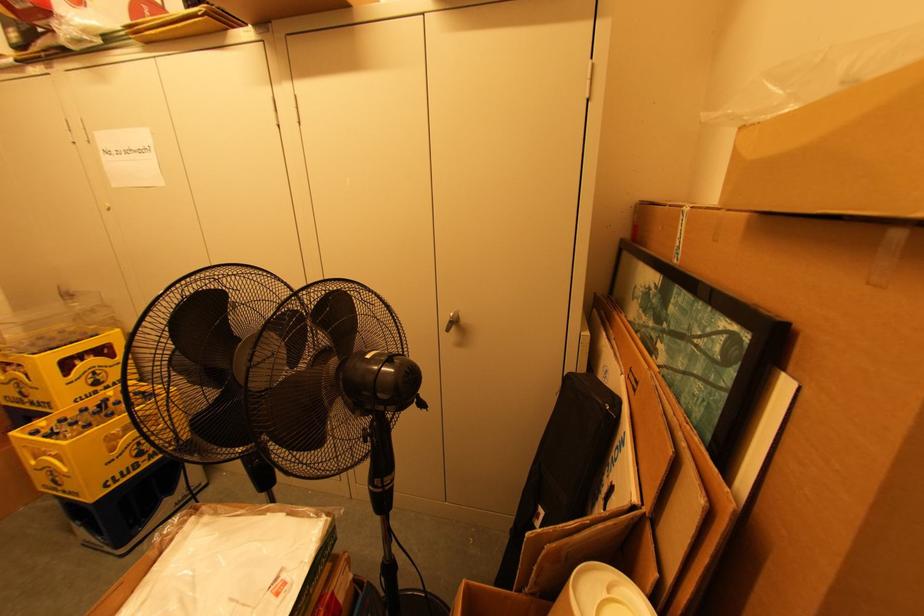
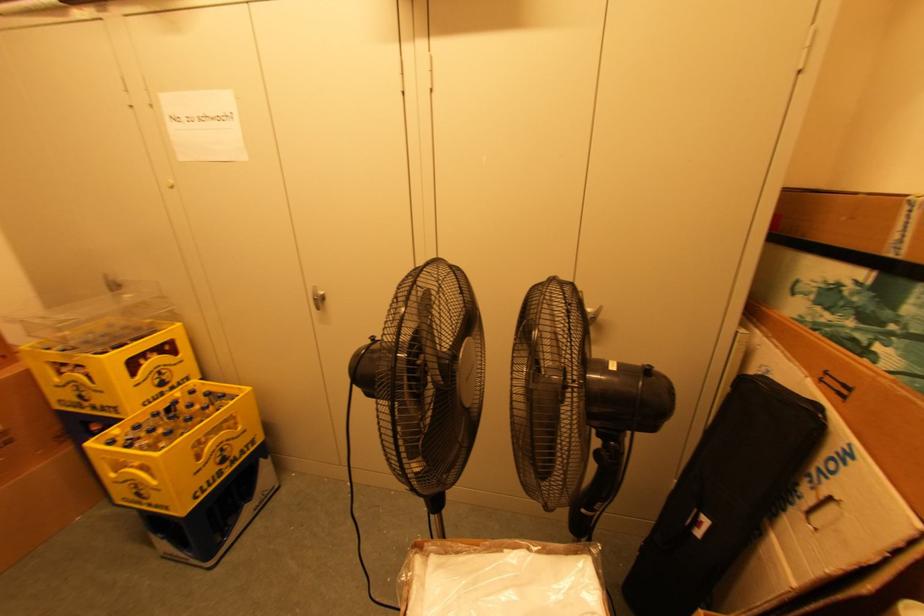
Question: What movement of the cameraman would produce the second image?

Choices:
 (A) Left
 (B) Right
 (C) Forward
 (D) Backward

Answer: (A)